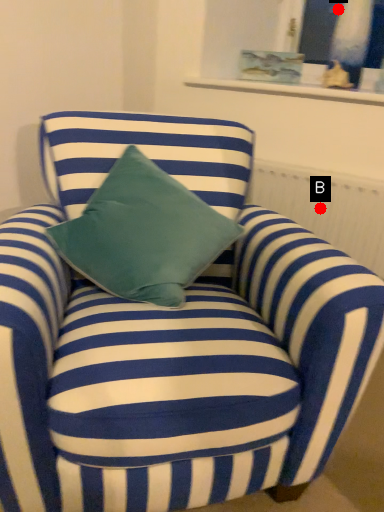
Question: Two points are circled on the image, labeled by A and B beside each circle. Among these points, which one is nearest to the camera?

Choices:
 (A) A is closer
 (B) B is closer

Answer: (B)